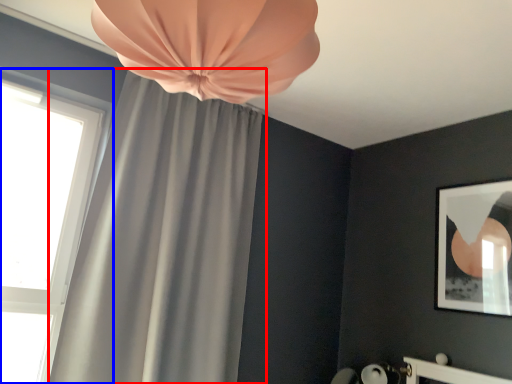
Question: Which object appears closest to the camera in this image, curtain (highlighted by a red box) or window (highlighted by a blue box)?

Choices:
 (A) curtain
 (B) window

Answer: (A)